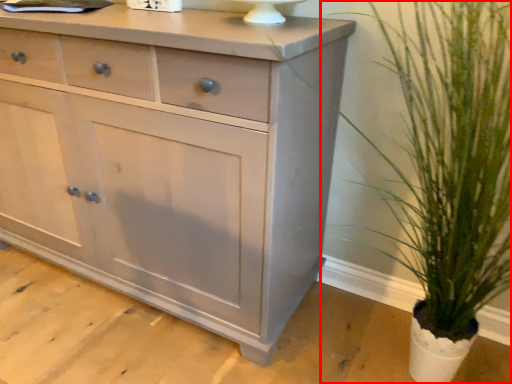
Question: In this image, where is houseplant (annotated by the red box) located relative to chest of drawers?

Choices:
 (A) left
 (B) right

Answer: (B)